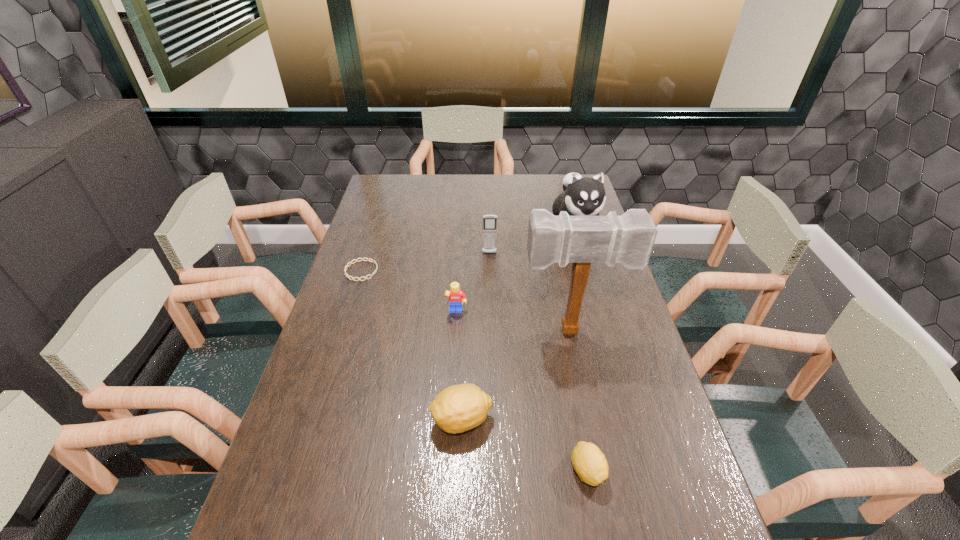
The width and height of the screenshot is (960, 540). In order to click on the tallest object in this screenshot , I will do `click(628, 239)`.

Find the location of a particular element. Image resolution: width=960 pixels, height=540 pixels. vacant space located at the stem end of the farther lemon is located at coordinates (403, 420).

Locate an element on the screen. vacant space situated 0.150m at the stem end of the farther lemon is located at coordinates (371, 420).

Locate an element on the screen. The width and height of the screenshot is (960, 540). free space located 0.320m at the stem end of the farther lemon is located at coordinates (300, 420).

Locate an element on the screen. The image size is (960, 540). vacant space situated at the stem end of the nearest object is located at coordinates (599, 534).

Locate an element on the screen. The image size is (960, 540). free space located at the face of the sixth shortest object is located at coordinates (593, 291).

Find the location of a particular element. Image resolution: width=960 pixels, height=540 pixels. vacant position located 0.210m on the front-facing side of the third tallest object is located at coordinates (491, 295).

Identify the location of free space located 0.090m on the face of the fourth nearest object. Image resolution: width=960 pixels, height=540 pixels. (455, 341).

At what (x,y) coordinates should I click in order to perform the action: click on blank space located 0.140m on the surface of the shortest object showing star-shaped elements. Please return your answer as a coordinate pair (x, y). The width and height of the screenshot is (960, 540). Looking at the image, I should click on (419, 271).

The height and width of the screenshot is (540, 960). Find the location of `vacant area located on the back of the tallest object`. vacant area located on the back of the tallest object is located at coordinates (565, 302).